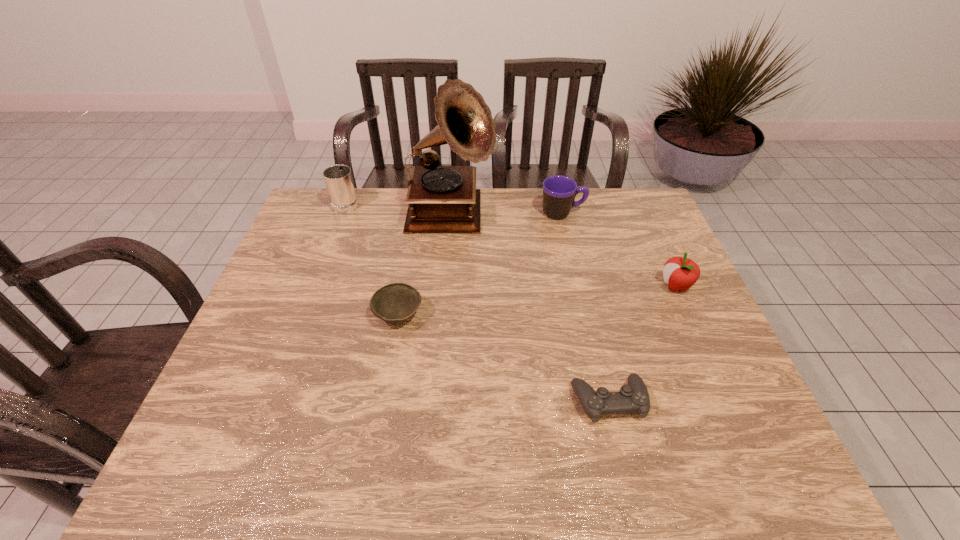
Find the location of `vacant space at the near right corner of the desktop`. vacant space at the near right corner of the desktop is located at coordinates (726, 449).

You are a GUI agent. You are given a task and a screenshot of the screen. Output one action in this format:
    pyautogui.click(x=<x>, y=<y>)
    Task: Click on the vacant space in between the nearest object and the left mug
    
    Given the screenshot: What is the action you would take?
    pyautogui.click(x=477, y=301)

Where is `vacant area that lies between the tallest object and the right mug`? This screenshot has height=540, width=960. vacant area that lies between the tallest object and the right mug is located at coordinates (507, 215).

I want to click on vacant region between the bowl and the tallest object, so click(x=424, y=266).

At what (x,y) coordinates should I click in order to perform the action: click on vacant region between the leftmost object and the apple. Please return your answer as a coordinate pair (x, y). Image resolution: width=960 pixels, height=540 pixels. Looking at the image, I should click on (511, 244).

The width and height of the screenshot is (960, 540). What are the coordinates of `vacant area that lies between the bowl and the rightmost object` in the screenshot? It's located at (537, 301).

The height and width of the screenshot is (540, 960). I want to click on unoccupied area between the record player and the bowl, so click(x=424, y=266).

Locate which object is the closest to the tallest object. Please provide its 2D coordinates. Your answer should be formatted as a tuple, i.e. [(x, y)], where the tuple contains the x and y coordinates of a point satisfying the conditions above.

[(559, 192)]

Identify which object is located as the fourth nearest to the leftmost object. Please provide its 2D coordinates. Your answer should be formatted as a tuple, i.e. [(x, y)], where the tuple contains the x and y coordinates of a point satisfying the conditions above.

[(634, 397)]

Identify the location of vacant space that satisfies the following two spatial constraints: 1. with the handle on the side of the apple; 2. on the right side of the right mug. (579, 286).